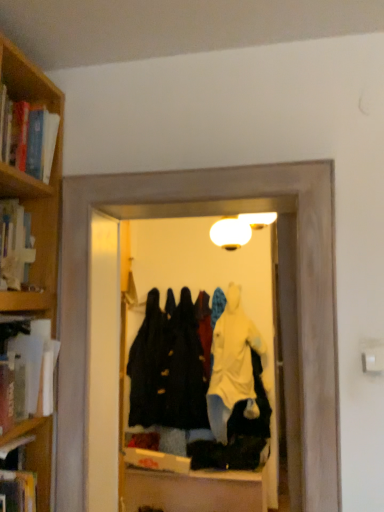
This screenshot has width=384, height=512. Describe the element at coordinates (34, 370) in the screenshot. I see `hardcover book at left, marked as the second book in a bottom-to-top arrangement` at that location.

This screenshot has height=512, width=384. Find the location of `hardcover book at left, the first book ordered from the bottom`. hardcover book at left, the first book ordered from the bottom is located at coordinates (18, 490).

Describe the element at coordinates (146, 364) in the screenshot. I see `black matte coat at center` at that location.

At what (x,y) coordinates should I click in order to perform the action: click on transparent plastic coat rack at center. Please return your answer as a coordinate pair (x, y). Looking at the image, I should click on (242, 340).

Describe the element at coordinates (242, 340) in the screenshot. The image size is (384, 512). I see `transparent plastic coat rack at center` at that location.

The width and height of the screenshot is (384, 512). Find the location of `light yellow cotton bathrobe at center`. light yellow cotton bathrobe at center is located at coordinates (232, 366).

This screenshot has width=384, height=512. Describe the element at coordinates (232, 366) in the screenshot. I see `light yellow cotton bathrobe at center` at that location.

Locate an element on the screen. The height and width of the screenshot is (512, 384). hardcover book at left, the third book viewed from the top is located at coordinates (34, 370).

Is point (49, 135) more distant than point (4, 490)?

Yes, point (49, 135) is behind point (4, 490).

Considering the relative positions of wooden bookshelf at upper left, which is the fourth book from bottom to top, and hardcover book at left, acting as the 4th book starting from the top, in the image provided, is wooden bookshelf at upper left, which is the fourth book from bottom to top, to the right of hardcover book at left, acting as the 4th book starting from the top, from the viewer's perspective?

Incorrect, wooden bookshelf at upper left, which is the fourth book from bottom to top, is not on the right side of hardcover book at left, acting as the 4th book starting from the top.

Is wooden bookshelf at upper left, which is the fourth book from bottom to top, with hardcover book at left, acting as the 4th book starting from the top?

No, wooden bookshelf at upper left, which is the fourth book from bottom to top, is not touching hardcover book at left, acting as the 4th book starting from the top.

Could you tell me if wooden bookshelf at upper left, the 1th book viewed from the top, is turned towards hardcover book at left, acting as the 4th book starting from the top?

No, wooden bookshelf at upper left, the 1th book viewed from the top, is not turned towards hardcover book at left, acting as the 4th book starting from the top.

Who is more distant, hardcover book at left, marked as the second book in a bottom-to-top arrangement, or hardcover book at left, arranged as the third book when ordered from the bottom?

hardcover book at left, arranged as the third book when ordered from the bottom, is behind.

Which of these two, hardcover book at left, marked as the second book in a bottom-to-top arrangement, or hardcover book at left, which ranks as the second book in top-to-bottom order, is thinner?

With smaller width is hardcover book at left, which ranks as the second book in top-to-bottom order.

From a real-world perspective, between hardcover book at left, marked as the second book in a bottom-to-top arrangement, and hardcover book at left, arranged as the third book when ordered from the bottom, who is vertically higher?

hardcover book at left, arranged as the third book when ordered from the bottom, from a real-world perspective.

What's the angular difference between hardcover book at left, the third book viewed from the top, and hardcover book at left, arranged as the third book when ordered from the bottom,'s facing directions?

The angular difference between hardcover book at left, the third book viewed from the top, and hardcover book at left, arranged as the third book when ordered from the bottom, is 0.000164 degrees.

Can you tell me how much transparent plastic coat rack at center and wooden bookshelf at upper left, which is the fourth book from bottom to top, differ in facing direction?

transparent plastic coat rack at center and wooden bookshelf at upper left, which is the fourth book from bottom to top, are facing 89.4 degrees away from each other.

Which is correct: transparent plastic coat rack at center is inside wooden bookshelf at upper left, which is the fourth book from bottom to top, or outside of it?

transparent plastic coat rack at center is spatially situated outside wooden bookshelf at upper left, which is the fourth book from bottom to top.

Is transparent plastic coat rack at center smaller than wooden bookshelf at upper left, which is the fourth book from bottom to top?

No.

Measure the distance between transparent plastic coat rack at center and wooden bookshelf at upper left, which is the fourth book from bottom to top.

transparent plastic coat rack at center and wooden bookshelf at upper left, which is the fourth book from bottom to top, are 2.19 meters apart from each other.

Measure the distance between hardcover book at left, marked as the second book in a bottom-to-top arrangement, and transparent plastic coat rack at center.

A distance of 6.53 feet exists between hardcover book at left, marked as the second book in a bottom-to-top arrangement, and transparent plastic coat rack at center.

Considering the relative sizes of hardcover book at left, marked as the second book in a bottom-to-top arrangement, and transparent plastic coat rack at center in the image provided, is hardcover book at left, marked as the second book in a bottom-to-top arrangement, taller than transparent plastic coat rack at center?

In fact, hardcover book at left, marked as the second book in a bottom-to-top arrangement, may be shorter than transparent plastic coat rack at center.

From the image's perspective, between hardcover book at left, marked as the second book in a bottom-to-top arrangement, and transparent plastic coat rack at center, who is located below?

hardcover book at left, marked as the second book in a bottom-to-top arrangement, from the image's perspective.

In the scene shown: Are hardcover book at left, marked as the second book in a bottom-to-top arrangement, and transparent plastic coat rack at center making contact?

No, hardcover book at left, marked as the second book in a bottom-to-top arrangement, is not with transparent plastic coat rack at center.

Considering the sizes of objects black matte coat at center and hardcover book at left, the first book ordered from the bottom, in the image provided, who is taller, black matte coat at center or hardcover book at left, the first book ordered from the bottom,?

black matte coat at center.

Would you say black matte coat at center is a long distance from hardcover book at left, the first book ordered from the bottom?

black matte coat at center is far away from hardcover book at left, the first book ordered from the bottom.

Could you tell me if black matte coat at center is turned towards hardcover book at left, acting as the 4th book starting from the top?

Yes, black matte coat at center faces towards hardcover book at left, acting as the 4th book starting from the top.

In the scene shown: From the image's perspective, which one is positioned higher, black matte coat at center or hardcover book at left, the first book ordered from the bottom?

hardcover book at left, the first book ordered from the bottom, is shown above in the image.

From the image's perspective, is hardcover book at left, the third book viewed from the top, above hardcover book at left, acting as the 4th book starting from the top?

Correct, hardcover book at left, the third book viewed from the top, appears higher than hardcover book at left, acting as the 4th book starting from the top, in the image.

Considering the relative sizes of hardcover book at left, the third book viewed from the top, and hardcover book at left, acting as the 4th book starting from the top, in the image provided, is hardcover book at left, the third book viewed from the top, taller than hardcover book at left, acting as the 4th book starting from the top,?

Yes.

Considering the sizes of hardcover book at left, the third book viewed from the top, and hardcover book at left, acting as the 4th book starting from the top, in the image, is hardcover book at left, the third book viewed from the top, bigger or smaller than hardcover book at left, acting as the 4th book starting from the top,?

In the image, hardcover book at left, the third book viewed from the top, appears to be larger than hardcover book at left, acting as the 4th book starting from the top.

Is transparent plastic coat rack at center spatially inside hardcover book at left, the first book ordered from the bottom, or outside of it?

The correct answer is: outside.

Which is less distant, (x=271, y=400) or (x=2, y=449)?

Point (x=271, y=400) appears to be farther away from the viewer than point (x=2, y=449).

This screenshot has height=512, width=384. What are the coordinates of `the 1st book counting from the left side of the transparent plastic coat rack at center` in the screenshot? It's located at (18, 490).

From the image's perspective, starting from the hardcover book at left, the first book ordered from the bottom, which book is the 3rd one above? Please provide its 2D coordinates.

[(28, 137)]

From the hardcover book at left, marked as the second book in a bottom-to-top arrangement, count the 2nd book to the left and point to it. Please provide its 2D coordinates.

[(15, 244)]

Based on their spatial positions, is light yellow cotton bathrobe at center or black matte coat at center closer to transparent plastic coat rack at center?

Among the two, light yellow cotton bathrobe at center is located nearer to transparent plastic coat rack at center.

Looking at the image, which one is located further to hardcover book at left, arranged as the third book when ordered from the bottom, light yellow cotton bathrobe at center or black matte coat at center?

Among the two, light yellow cotton bathrobe at center is located further to hardcover book at left, arranged as the third book when ordered from the bottom.

Based on their spatial positions, is hardcover book at left, the third book viewed from the top, or transparent plastic coat rack at center further from black matte coat at center?

hardcover book at left, the third book viewed from the top, is further to black matte coat at center.

Considering their positions, is wooden bookshelf at upper left, the 1th book viewed from the top, positioned closer to light yellow cotton bathrobe at center than hardcover book at left, the third book viewed from the top?

hardcover book at left, the third book viewed from the top, is positioned closer to the anchor light yellow cotton bathrobe at center.

Considering their positions, is light yellow cotton bathrobe at center positioned closer to hardcover book at left, which ranks as the second book in top-to-bottom order, than hardcover book at left, the first book ordered from the bottom?

hardcover book at left, the first book ordered from the bottom, is closer to hardcover book at left, which ranks as the second book in top-to-bottom order.

Considering their positions, is transparent plastic coat rack at center positioned closer to hardcover book at left, which ranks as the second book in top-to-bottom order, than hardcover book at left, acting as the 4th book starting from the top?

The object closer to hardcover book at left, which ranks as the second book in top-to-bottom order, is hardcover book at left, acting as the 4th book starting from the top.

Based on their spatial positions, is hardcover book at left, the third book viewed from the top, or light yellow cotton bathrobe at center further from hardcover book at left, arranged as the third book when ordered from the bottom?

light yellow cotton bathrobe at center is further to hardcover book at left, arranged as the third book when ordered from the bottom.

Which object lies nearer to the anchor point black matte coat at center, hardcover book at left, the first book ordered from the bottom, or light yellow cotton bathrobe at center?

light yellow cotton bathrobe at center lies closer to black matte coat at center than the other object.

Identify the location of glass door between hardcover book at left, which ranks as the second book in top-to-bottom order, and hardcover book at left, acting as the 4th book starting from the top, in the up-down direction. (242, 340).

In order to click on glass door located between hardcover book at left, arranged as the third book when ordered from the bottom, and black matte coat at center in the depth direction in this screenshot , I will do `click(242, 340)`.

Identify the location of bathrobe between hardcover book at left, marked as the second book in a bottom-to-top arrangement, and black matte coat at center in the front-back direction. The image size is (384, 512). (232, 366).

You are a GUI agent. You are given a task and a screenshot of the screen. Output one action in this format:
    pyautogui.click(x=<x>, y=<y>)
    Task: Click on the glass door positioned between hardcover book at left, the third book viewed from the top, and light yellow cotton bathrobe at center from near to far
    
    Given the screenshot: What is the action you would take?
    pyautogui.click(x=242, y=340)